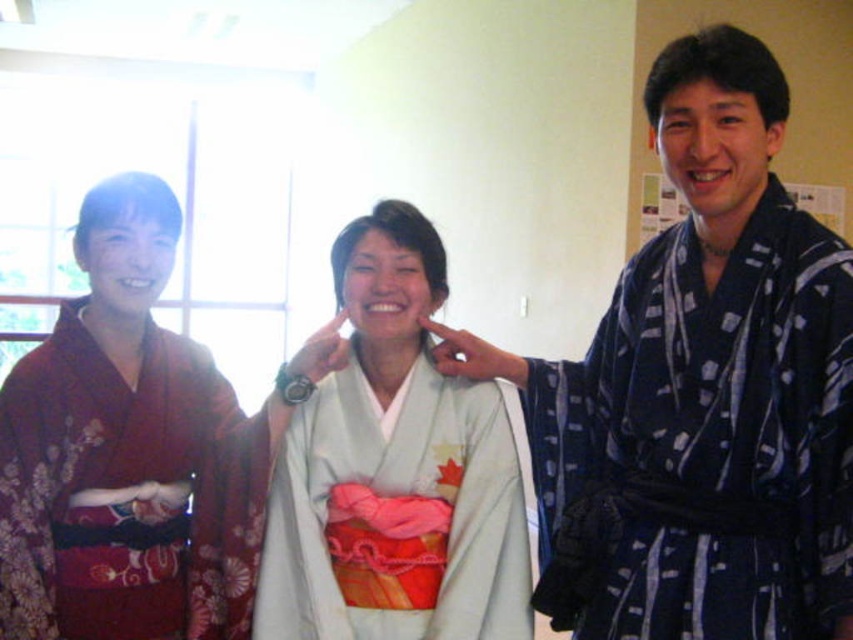
You are organizing a traditional Japanese tea ceremony and need to arrange the kimonos based on their size. Given that you have the white silk kimono at center and the matte red kimono at left, which kimono should you place on the smaller display stand?

The white silk kimono at center should be placed on the smaller display stand because it occupies less space than the matte red kimono at left.

You are organizing a traditional Japanese tea ceremony and need to arrange seating based on the kimonos. Since the blue printed robe at right is larger than the matte red kimono at left, which kimono should be seated closer to the tea master to signify respect?

The blue printed robe at right should be seated closer to the tea master because it has a larger size compared to the matte red kimono at left, indicating higher status or respect in traditional settings.